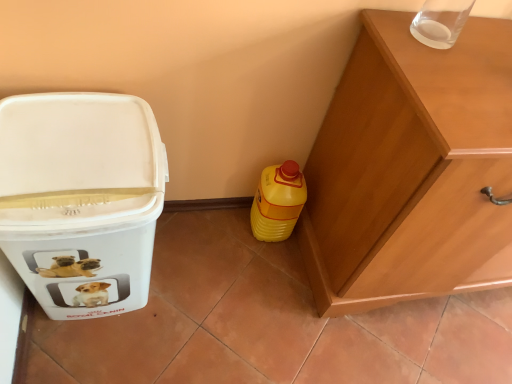
In order to click on vacant space in front of wooden cabinet at right in this screenshot , I will do `click(411, 342)`.